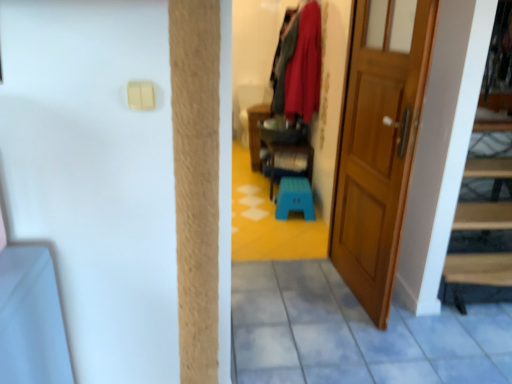
Question: Can you confirm if velvet red coat at upper center is positioned to the right of wooden door at right?

Choices:
 (A) no
 (B) yes

Answer: (A)

Question: Is velvet red coat at upper center to the left of wooden door at right from the viewer's perspective?

Choices:
 (A) yes
 (B) no

Answer: (A)

Question: Is velvet red coat at upper center bigger than wooden door at right?

Choices:
 (A) yes
 (B) no

Answer: (B)

Question: Is velvet red coat at upper center positioned with its back to wooden door at right?

Choices:
 (A) no
 (B) yes

Answer: (A)

Question: From the image's perspective, is velvet red coat at upper center above wooden door at right?

Choices:
 (A) yes
 (B) no

Answer: (A)

Question: Could you tell me if velvet red coat at upper center is facing wooden door at right?

Choices:
 (A) yes
 (B) no

Answer: (B)

Question: Is wooden cabinet at center, positioned as the second furniture in right-to-left order, oriented away from velvet red coat at upper center?

Choices:
 (A) yes
 (B) no

Answer: (B)

Question: Can you confirm if wooden cabinet at center, arranged as the 1th furniture when viewed from the left, is positioned to the right of velvet red coat at upper center?

Choices:
 (A) no
 (B) yes

Answer: (A)

Question: Does wooden cabinet at center, positioned as the second furniture in right-to-left order, have a lesser width compared to velvet red coat at upper center?

Choices:
 (A) no
 (B) yes

Answer: (A)

Question: Is wooden cabinet at center, arranged as the 1th furniture when viewed from the left, to the left of velvet red coat at upper center from the viewer's perspective?

Choices:
 (A) no
 (B) yes

Answer: (B)

Question: Can velvet red coat at upper center be found inside wooden cabinet at center, arranged as the 1th furniture when viewed from the left?

Choices:
 (A) no
 (B) yes

Answer: (A)

Question: Can you confirm if wooden cabinet at center, positioned as the second furniture in right-to-left order, is taller than velvet red coat at upper center?

Choices:
 (A) yes
 (B) no

Answer: (B)

Question: From a real-world perspective, is wooden door at right under wooden cabinet at center, positioned as the second furniture in right-to-left order?

Choices:
 (A) no
 (B) yes

Answer: (A)